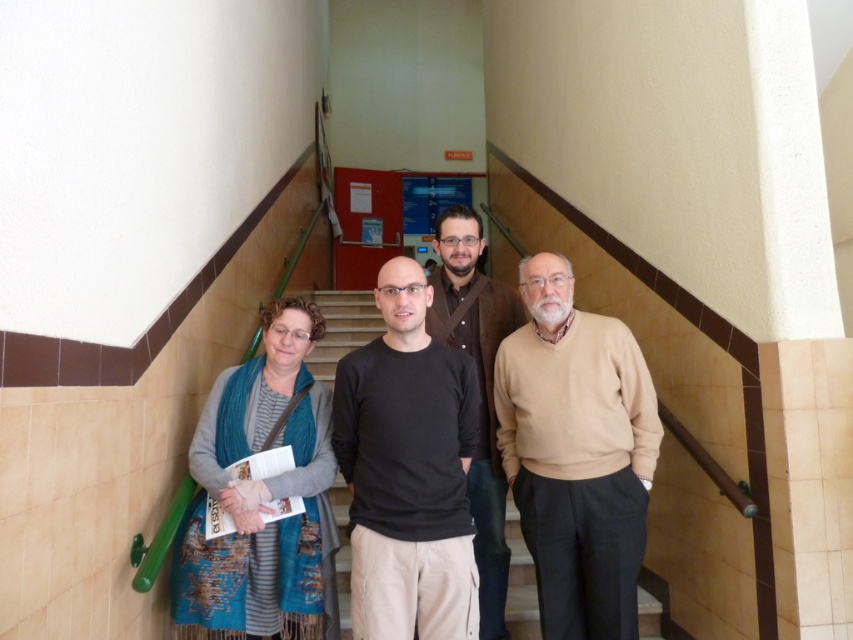
Consider the image. You are standing at the bottom of the staircase and want to hand a document to the person wearing the black matte shirt at center. Based on their position, where should you walk to reach them?

The black matte shirt at center is located at point 0.736 on the x axis and 0.479 on the y axis, so you should walk towards the center of the staircase where their coordinates are to reach them.

You are standing at the bottom of the staircase and want to hand a document to the person wearing the beige sweater at center. If your arm can reach up to 1.8 meters, can you reach them without moving closer?

The beige sweater at center is 2.09 meters away from the viewer, which is beyond the arm reach of 1.8 meters. Therefore, you cannot reach them without moving closer.

You are an office worker who needs to choose between wearing the beige sweater at center or the blue textured scarf at left for a meeting. Based on their sizes, which would you recommend for a more professional look?

The beige sweater at center is bigger than the blue textured scarf at left, so the beige sweater at center would be more appropriate for a professional look as it is larger and likely covers more appropriately.